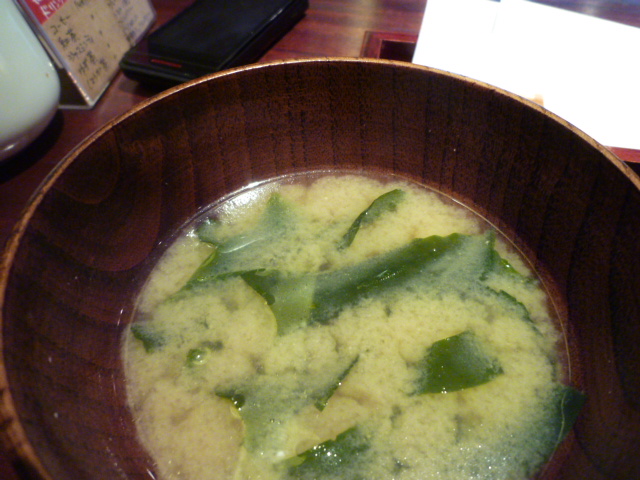
The image size is (640, 480). I want to click on wood table, so click(321, 26).